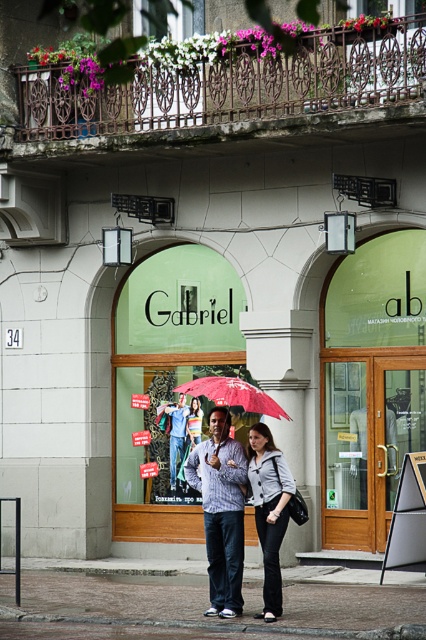
You are standing on the brown brick pavement at center and looking up at the matte gray blazer at center. Which object is taller?

The matte gray blazer at center is taller than the brown brick pavement at center.

You are a fashion designer observing the street scene. You notice the matte gray blazer at center and the red matte umbrella at center. Which item has a smaller width?

The matte gray blazer at center has a lesser width compared to the red matte umbrella at center.